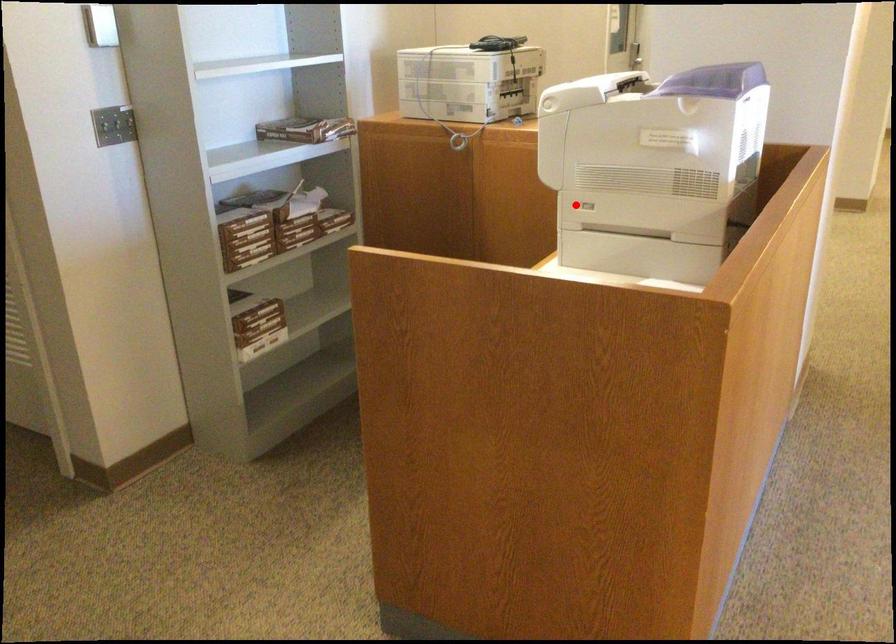
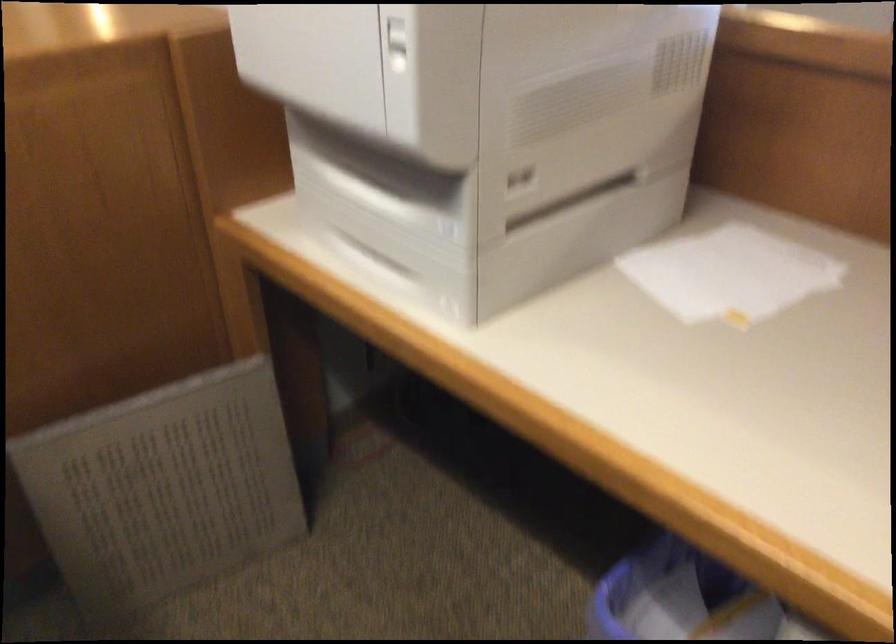
Locate, in the second image, the point that corresponds to the highlighted location in the first image.

(391, 220)